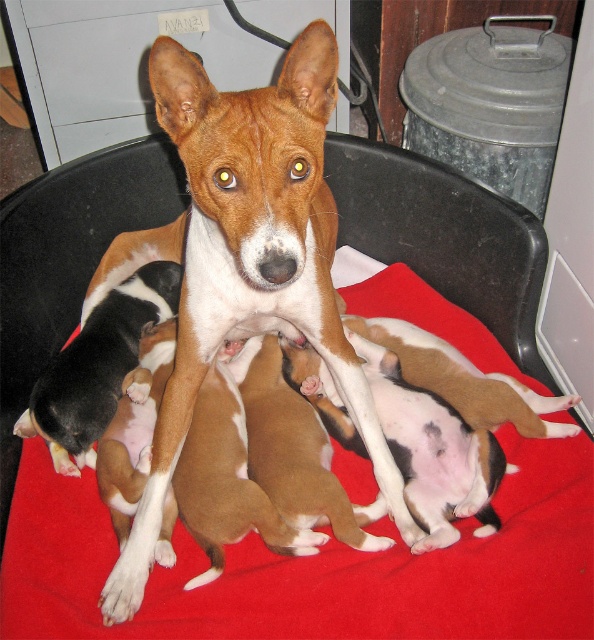
You are a photographer setting up equipment in the room. You need to place a new camera tripod that requires 1 meter of space. The galvanized metal trash can at upper right and the black and white fur at center are in the way. Which object should you move to free up enough space for the tripod?

The galvanized metal trash can at upper right is bigger than the black and white fur at center, so you should move the galvanized metal trash can at upper right to free up enough space for the tripod.

You are a photographer setting up a shoot in this scene. You need to place a small tripod on the red fabric blanket at center without disturbing the black and white fur at center. Is there enough space on the blanket for the tripod?

The red fabric blanket at center has a larger width than the black and white fur at center, so there is enough space on the blanket to place the tripod without disturbing the puppies.